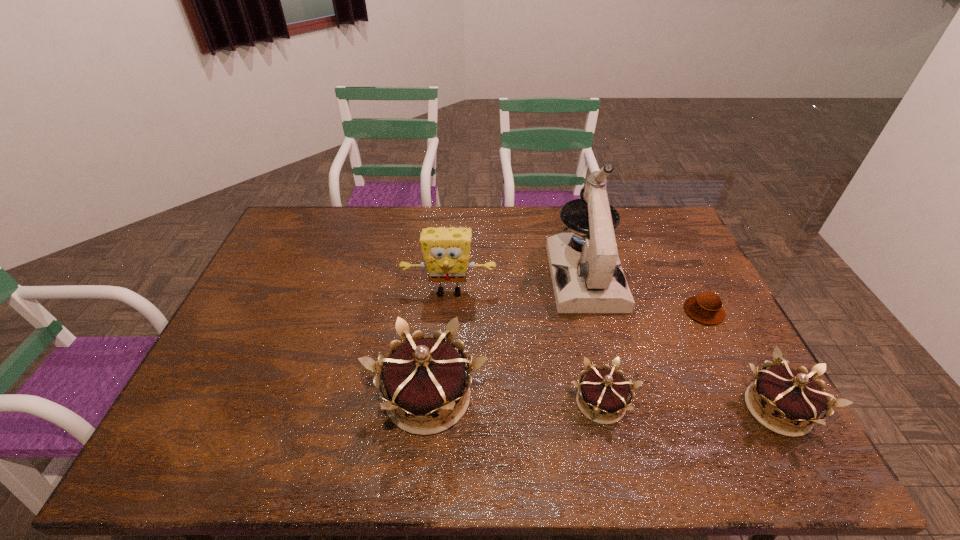
Identify the location of free spot at the left edge of the desktop. 292,294.

At what (x,y) coordinates should I click in order to perform the action: click on vacant region at the right edge of the desktop. Please return your answer as a coordinate pair (x, y). Looking at the image, I should click on (646, 248).

You are a GUI agent. You are given a task and a screenshot of the screen. Output one action in this format:
    pyautogui.click(x=<x>, y=<y>)
    Task: Click on the free spot at the far left corner of the desktop
    
    Given the screenshot: What is the action you would take?
    pyautogui.click(x=325, y=218)

Locate an element on the screen. Image resolution: width=960 pixels, height=540 pixels. vacant space at the near left corner of the desktop is located at coordinates (210, 392).

In the image, there is a desktop. Where is `vacant region at the far right corner`? This screenshot has width=960, height=540. vacant region at the far right corner is located at coordinates (653, 207).

You are a GUI agent. You are given a task and a screenshot of the screen. Output one action in this format:
    pyautogui.click(x=<x>, y=<y>)
    Task: Click on the free spot between the sponge and the shortest crown
    The image size is (960, 540).
    Given the screenshot: What is the action you would take?
    pyautogui.click(x=525, y=347)

You are a GUI agent. You are given a task and a screenshot of the screen. Output one action in this format:
    pyautogui.click(x=<x>, y=<y>)
    Task: Click on the vacant point located between the second crown from left to right and the muffin
    
    Given the screenshot: What is the action you would take?
    pyautogui.click(x=653, y=357)

Find the location of a particular element. This screenshot has width=960, height=540. empty space that is in between the muffin and the tallest crown is located at coordinates (566, 354).

Where is `vacant space that's between the sponge and the microscope`? vacant space that's between the sponge and the microscope is located at coordinates (517, 284).

Locate an element on the screen. This screenshot has height=540, width=960. empty space between the second shortest object and the second shortest crown is located at coordinates tap(689, 406).